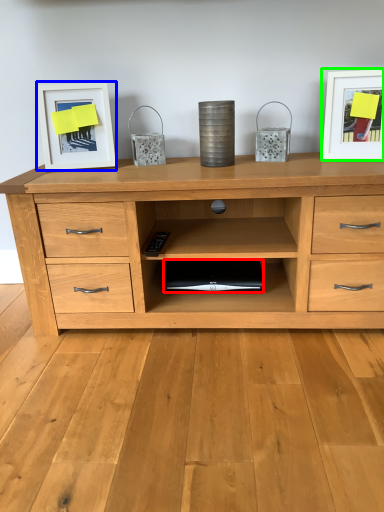
Question: Estimate the real-world distances between objects in this image. Which object is closer to computer (highlighted by a red box), picture frame (highlighted by a blue box) or picture frame (highlighted by a green box)?

Choices:
 (A) picture frame
 (B) picture frame

Answer: (A)